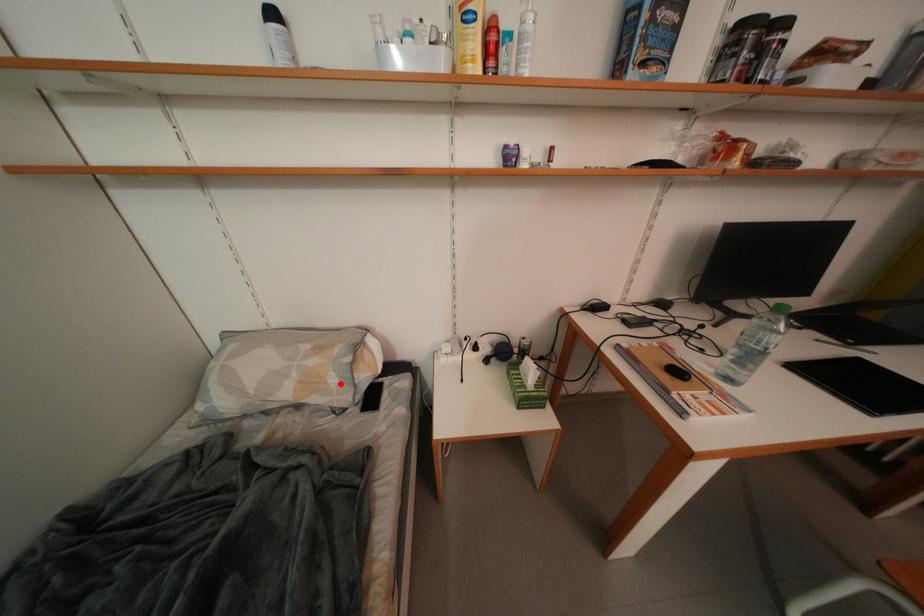
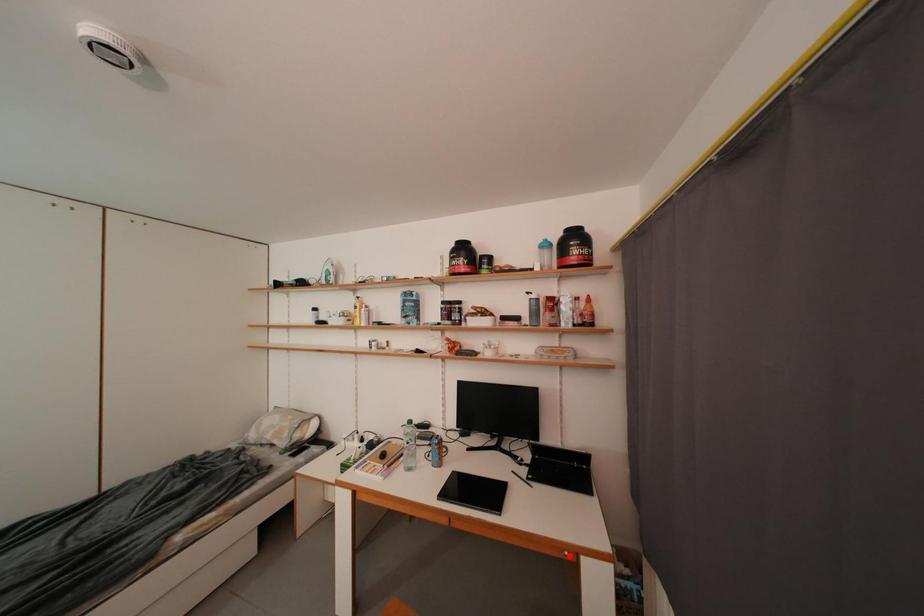
I am providing you with two images of the same scene from different viewpoints. A red point is marked on the first image and another point is marked on the second image. Do the highlighted points in image1 and image2 indicate the same real-world spot?

No